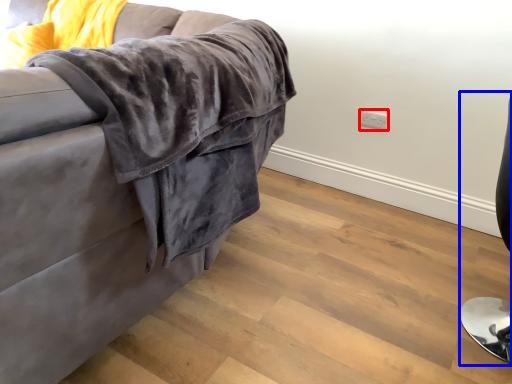
Question: Which object appears closest to the camera in this image, electric outlet (highlighted by a red box) or computer chair (highlighted by a blue box)?

Choices:
 (A) electric outlet
 (B) computer chair

Answer: (B)